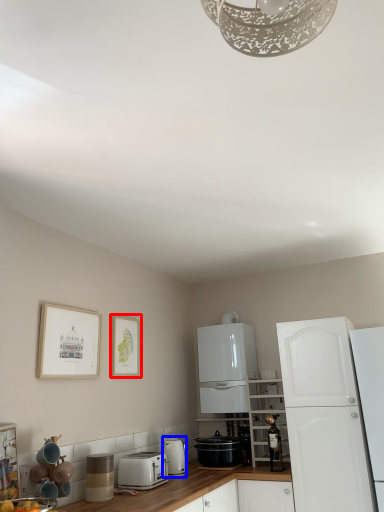
Question: Among these objects, which one is farthest to the camera, picture frame (highlighted by a red box) or kitchen appliance (highlighted by a blue box)?

Choices:
 (A) picture frame
 (B) kitchen appliance

Answer: (B)